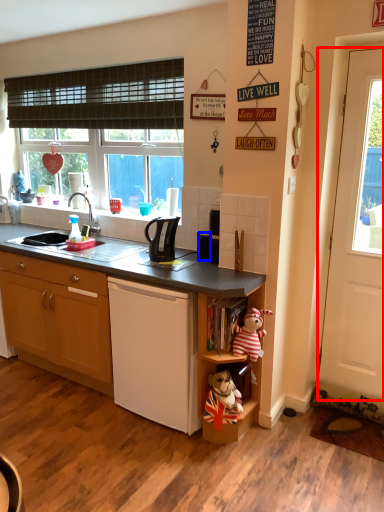
Question: Which object appears closest to the camera in this image, door (highlighted by a red box) or appliance (highlighted by a blue box)?

Choices:
 (A) door
 (B) appliance

Answer: (A)